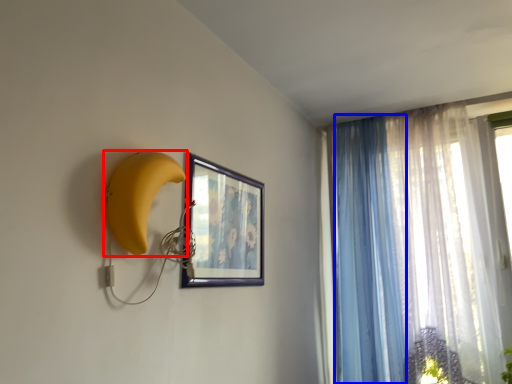
Question: Which object appears farthest to the camera in this image, banana (highlighted by a red box) or curtain (highlighted by a blue box)?

Choices:
 (A) banana
 (B) curtain

Answer: (B)